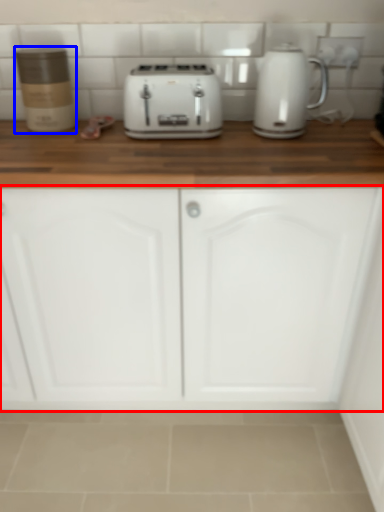
Question: Which object appears closest to the camera in this image, cabinetry (highlighted by a red box) or kitchen appliance (highlighted by a blue box)?

Choices:
 (A) cabinetry
 (B) kitchen appliance

Answer: (A)